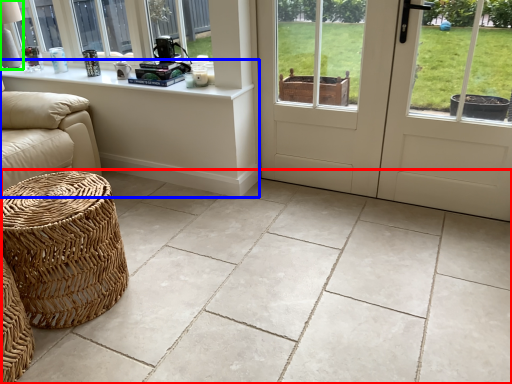
Question: Which object is the closest to the ceramic tile (highlighted by a red box)? Choose among these: table (highlighted by a blue box) or table lamp (highlighted by a green box).

Choices:
 (A) table
 (B) table lamp

Answer: (A)